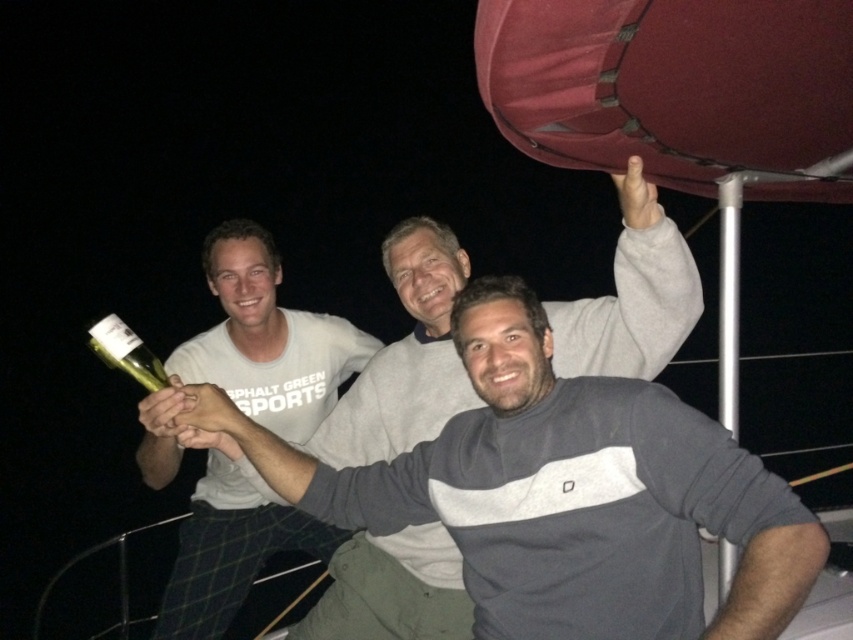
You are taking a photo of two points in the image. The first point is at coordinates point (x=660, y=312) and the second point is at point (x=242, y=595). Which point is closer to the camera?

Point (x=660, y=312) is closer to the camera than point (x=242, y=595).

You are standing at point (x=637, y=205) and want to take a photo of the scene. The camera is 5.33 feet away from you. Can you reach the camera to take the photo without moving from your current position?

The camera is 5.33 feet away from point (x=637, y=205). Since the average human arm length is about 2.5 feet, you cannot reach the camera without moving from your current position.